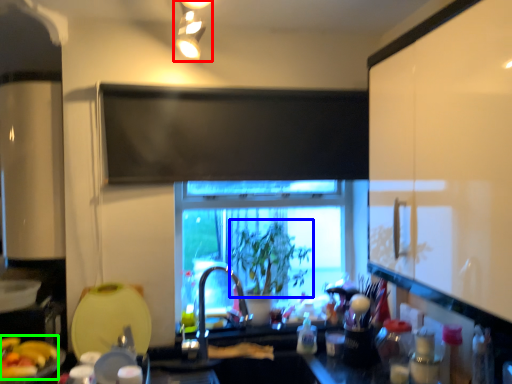
Question: Which is farther away from light fixture (highlighted by a red box)? plant (highlighted by a blue box) or food (highlighted by a green box)?

Choices:
 (A) plant
 (B) food

Answer: (B)